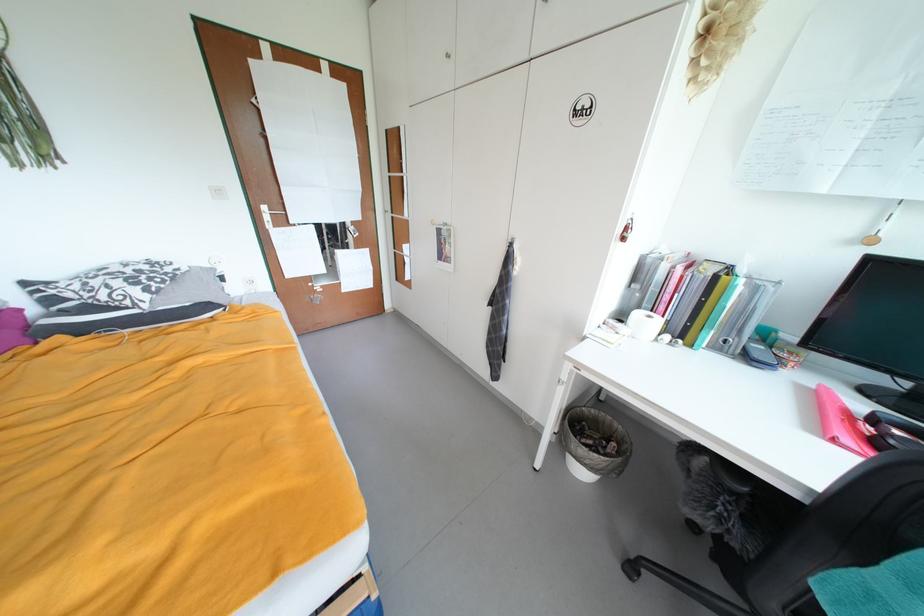
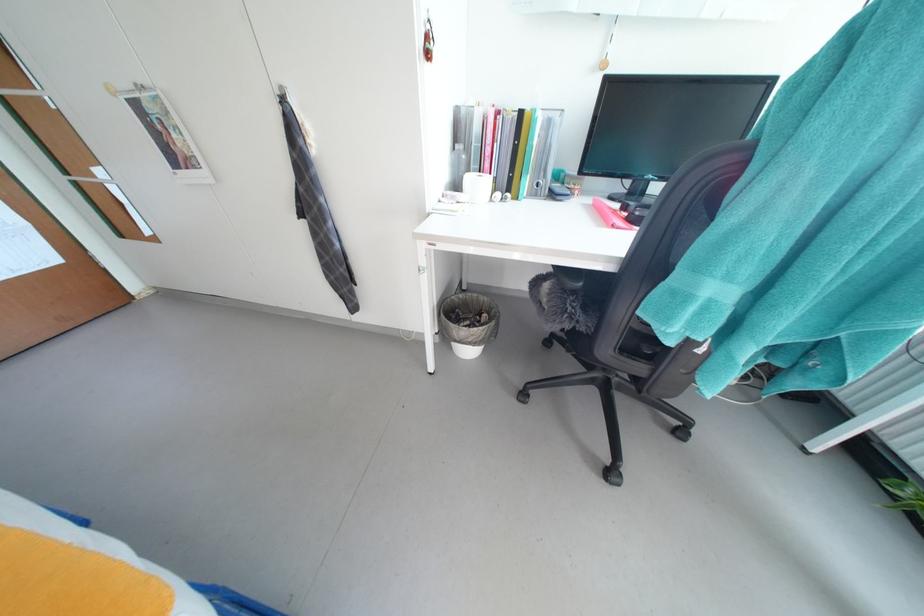
The point at (694, 331) is marked in the first image. Where is the corresponding point in the second image?

(517, 183)